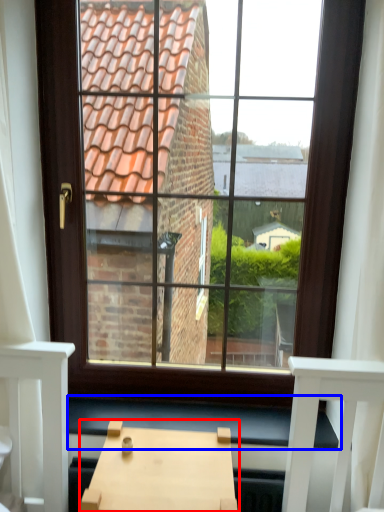
Question: Which object appears farthest to the camera in this image, table (highlighted by a red box) or window sill (highlighted by a blue box)?

Choices:
 (A) table
 (B) window sill

Answer: (B)